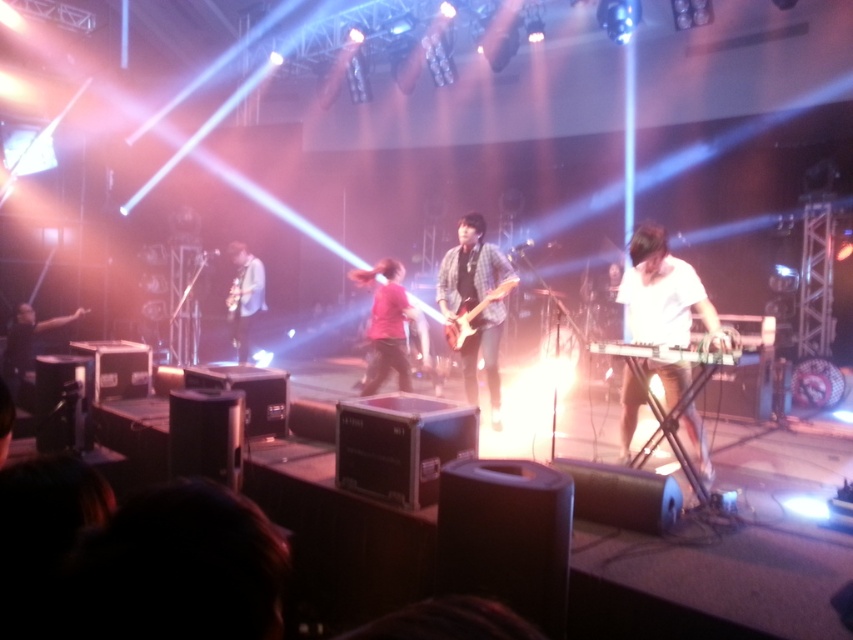
Question: Does white matte keyboardist at right have a smaller size compared to matte black guitar at center?

Choices:
 (A) no
 (B) yes

Answer: (A)

Question: Which point is closer to the camera taking this photo?

Choices:
 (A) (32, 340)
 (B) (447, 332)

Answer: (B)

Question: Can you confirm if matte black guitar at center is positioned to the left of black drum at left?

Choices:
 (A) yes
 (B) no

Answer: (B)

Question: Is white matte keyboardist at right smaller than plaid shirt guitar at center?

Choices:
 (A) no
 (B) yes

Answer: (A)

Question: Estimate the real-world distances between objects in this image. Which object is farther from the plaid shirt guitar at center?

Choices:
 (A) black drum at left
 (B) white matte keyboardist at right
 (C) metallic silver guitar at center

Answer: (A)

Question: Which object is the closest to the matte black guitar at center?

Choices:
 (A) black drum at left
 (B) plaid shirt guitar at center
 (C) white matte keyboardist at right

Answer: (A)